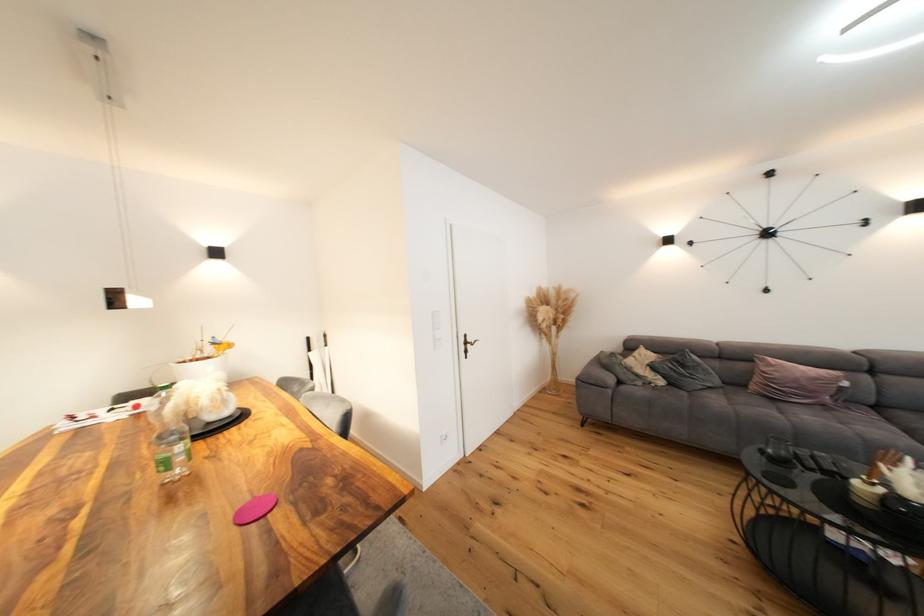
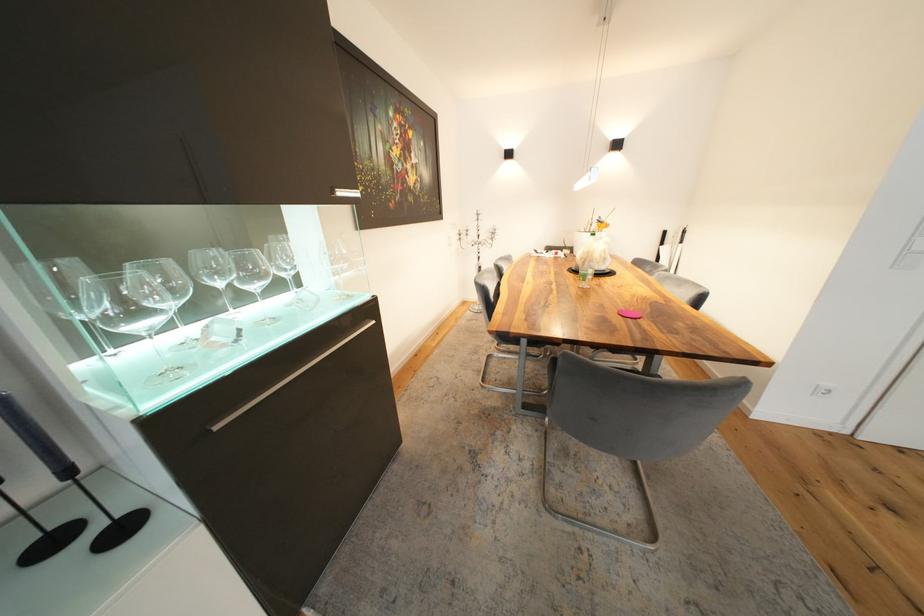
The point at (195, 405) is marked in the first image. Where is the corresponding point in the second image?

(594, 254)